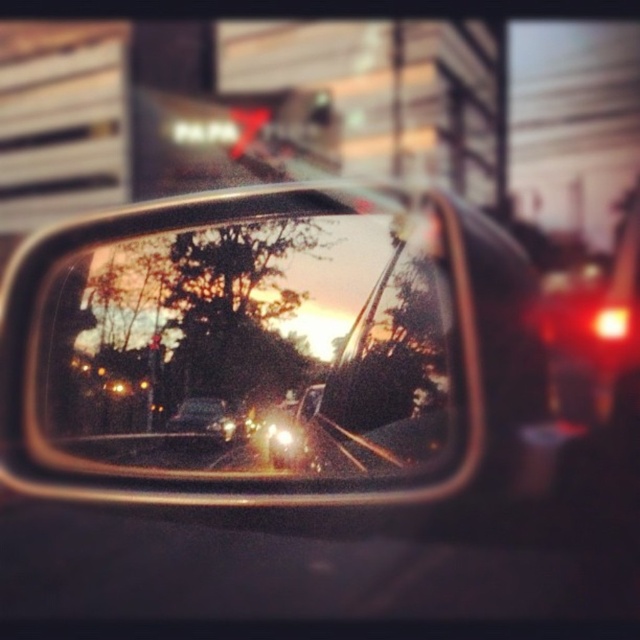
Question: Among these objects, which one is farthest from the camera?

Choices:
 (A) matte black car at center
 (B) metallic silver train track at center

Answer: (A)

Question: Can you confirm if metallic silver train track at center is positioned to the right of matte black car at center?

Choices:
 (A) no
 (B) yes

Answer: (B)

Question: Which object is positioned farthest from the matte black car at center?

Choices:
 (A) metallic reflective mirror at center
 (B) metallic silver train track at center

Answer: (A)

Question: Is metallic silver train track at center smaller than matte black car at center?

Choices:
 (A) yes
 (B) no

Answer: (B)

Question: Can you confirm if metallic reflective mirror at center is positioned to the right of metallic silver train track at center?

Choices:
 (A) no
 (B) yes

Answer: (A)

Question: Which of the following is the farthest from the observer?

Choices:
 (A) (321, 452)
 (B) (188, 419)

Answer: (B)